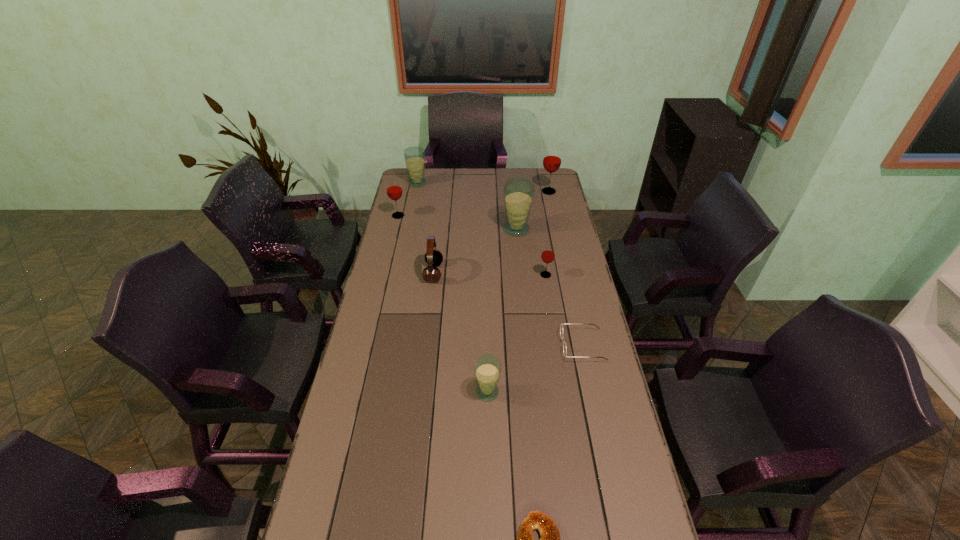
At what (x,y) coordinates should I click in order to perform the action: click on the biggest red glass. Please return your answer as a coordinate pair (x, y). This screenshot has height=540, width=960. Looking at the image, I should click on (552, 158).

Image resolution: width=960 pixels, height=540 pixels. Find the location of `the farthest red glass`. the farthest red glass is located at coordinates (552, 158).

I want to click on the biggest blue glass, so click(x=518, y=193).

Image resolution: width=960 pixels, height=540 pixels. I want to click on the second nearest blue glass, so click(x=518, y=193).

Where is `the second biggest blue glass`? the second biggest blue glass is located at coordinates (414, 156).

Where is `the farthest blue glass`? The width and height of the screenshot is (960, 540). the farthest blue glass is located at coordinates (414, 156).

At what (x,y) coordinates should I click in order to perform the action: click on the second nearest red glass. Please return your answer as a coordinate pair (x, y). Looking at the image, I should click on (394, 191).

This screenshot has width=960, height=540. In order to click on the second smallest red glass in this screenshot , I will do `click(394, 191)`.

At what (x,y) coordinates should I click in order to perform the action: click on the seventh object from right to left. Please return your answer as a coordinate pair (x, y). Looking at the image, I should click on (433, 257).

The width and height of the screenshot is (960, 540). Find the location of `black headset`. black headset is located at coordinates (433, 257).